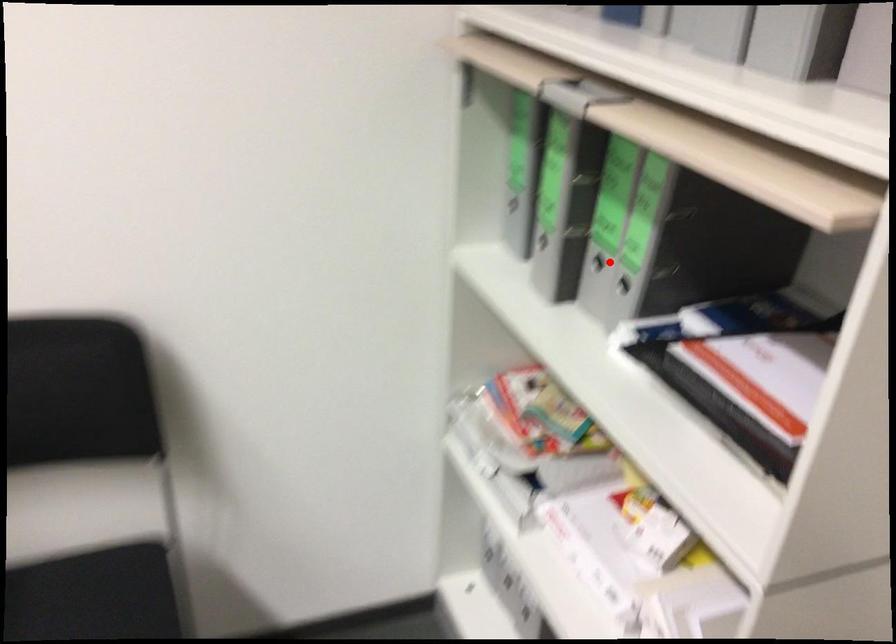
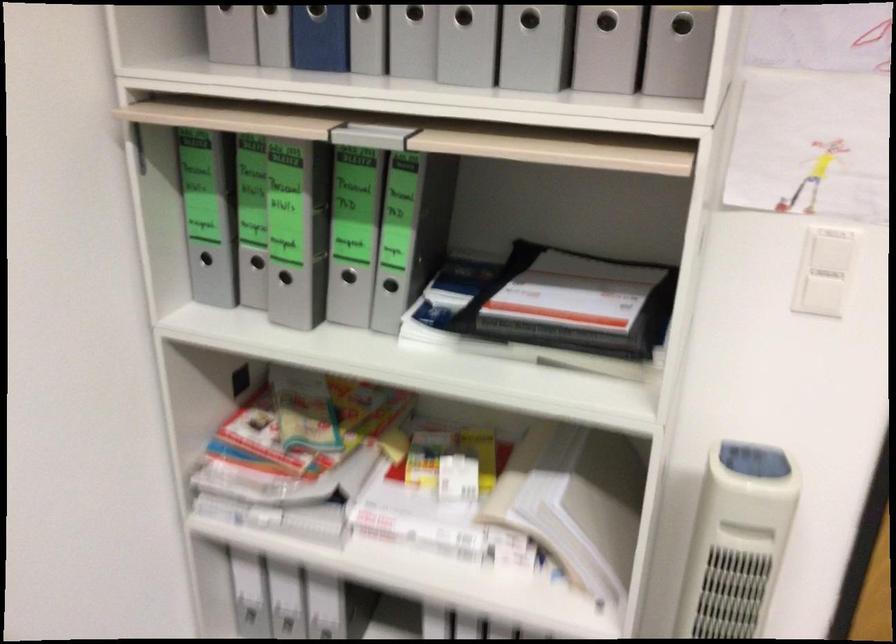
Where in the second image is the point corresponding to the highlighted location from the first image?

(348, 276)